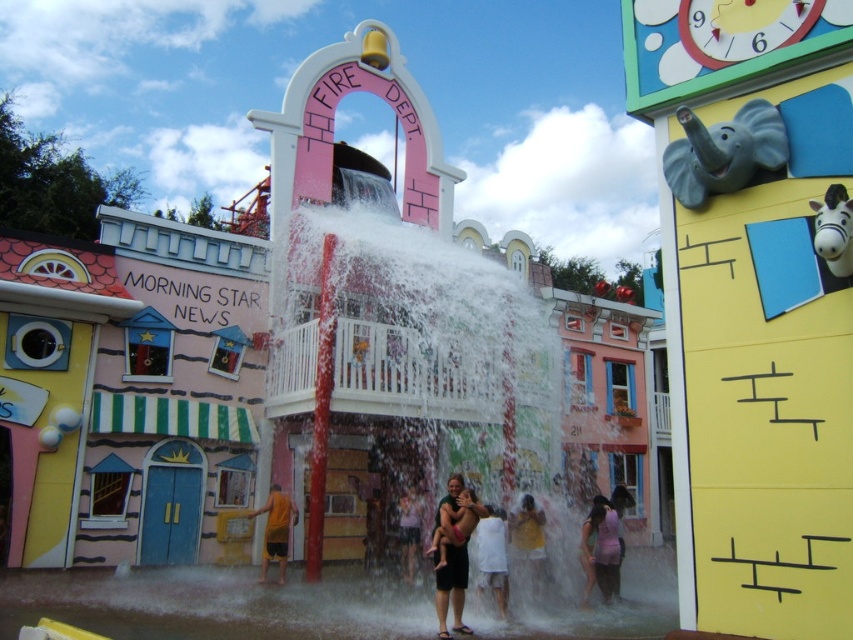
Question: Is pink fabric dress at lower center smaller than yellow matte shirt at lower center?

Choices:
 (A) no
 (B) yes

Answer: (A)

Question: Which of the following is the farthest from the observer?

Choices:
 (A) orange matte shorts at center
 (B) pink fabric dress at lower center
 (C) matte yellow clock at upper right
 (D) clear water at lower center

Answer: (B)

Question: Which object is closer to the camera taking this photo?

Choices:
 (A) clear water at lower center
 (B) orange matte shorts at center
 (C) matte yellow clock at upper right

Answer: (C)

Question: Is matte black shorts at lower center below pink fabric dress at lower center?

Choices:
 (A) yes
 (B) no

Answer: (B)

Question: Considering the relative positions of matte black shorts at lower center and pink fabric dress at lower center in the image provided, where is matte black shorts at lower center located with respect to pink fabric dress at lower center?

Choices:
 (A) below
 (B) above

Answer: (B)

Question: Estimate the real-world distances between objects in this image. Which object is closer to the yellow matte shirt at lower center?

Choices:
 (A) orange matte shorts at center
 (B) clear water at lower center
 (C) matte black shorts at lower center
 (D) pink fabric dress at lower center

Answer: (D)